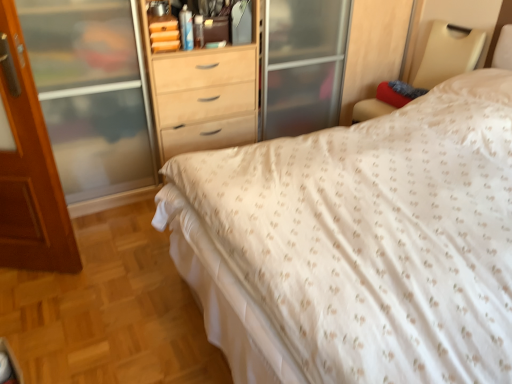
Question: Is white fabric bed frame at upper right wider or thinner than white textured bed at center?

Choices:
 (A) thin
 (B) wide

Answer: (A)

Question: From the image's perspective, is white fabric bed frame at upper right above or below white textured bed at center?

Choices:
 (A) above
 (B) below

Answer: (A)

Question: Which object is positioned closest to the white textured bed at center?

Choices:
 (A) brown wooden door at left
 (B) white fabric bed frame at upper right
 (C) matte wood dresser at center

Answer: (A)

Question: Which object is the closest to the white fabric bed frame at upper right?

Choices:
 (A) white textured bed at center
 (B) matte wood dresser at center
 (C) brown wooden door at left

Answer: (B)